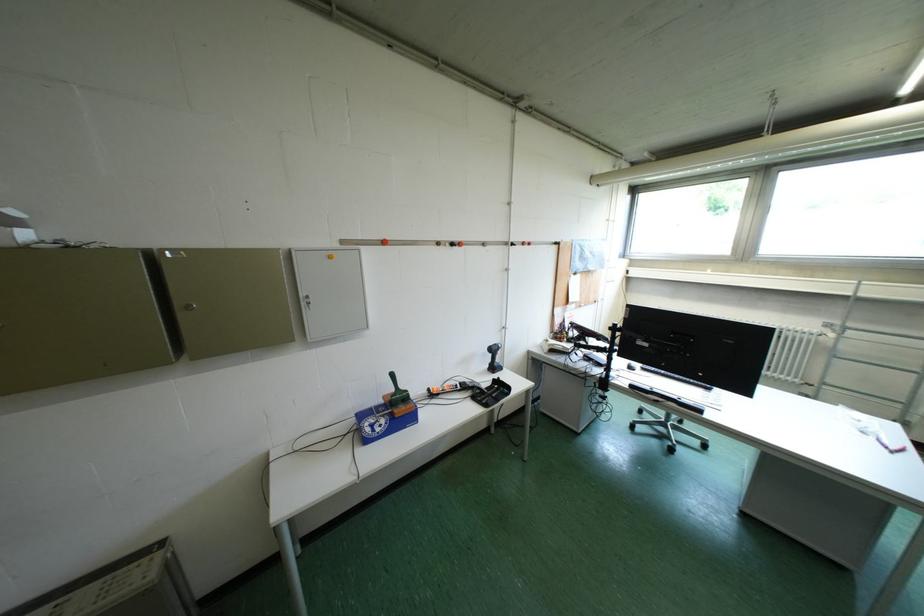
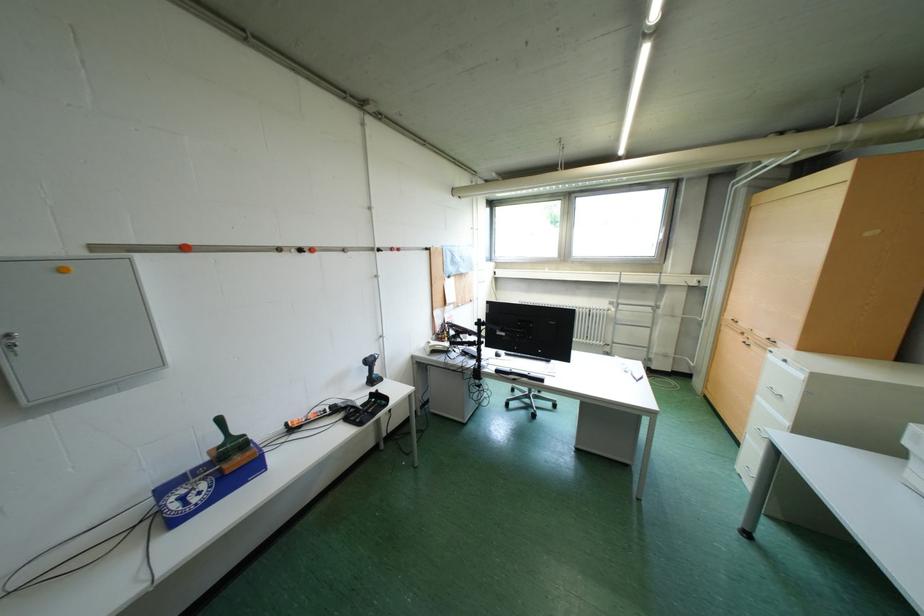
Question: What movement of the cameraman would produce the second image?

Choices:
 (A) Left
 (B) Right
 (C) Forward
 (D) Backward

Answer: (B)